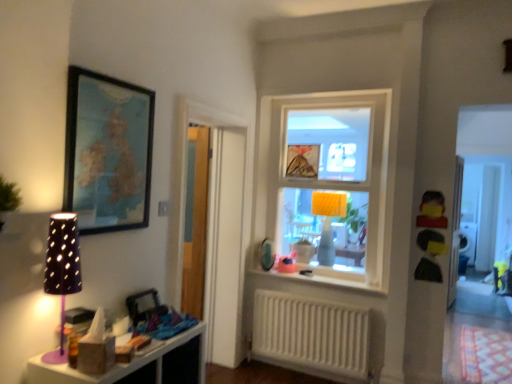
Question: Does matte plastic shelf at lower left have a smaller size compared to clear glass window at center?

Choices:
 (A) yes
 (B) no

Answer: (A)

Question: Is matte plastic shelf at lower left positioned behind clear glass window at center?

Choices:
 (A) no
 (B) yes

Answer: (A)

Question: From a real-world perspective, is matte plastic shelf at lower left under clear glass window at center?

Choices:
 (A) no
 (B) yes

Answer: (B)

Question: From a real-world perspective, is matte plastic shelf at lower left positioned over clear glass window at center based on gravity?

Choices:
 (A) no
 (B) yes

Answer: (A)

Question: Is matte plastic shelf at lower left facing away from clear glass window at center?

Choices:
 (A) yes
 (B) no

Answer: (B)

Question: Can clear glass window at center be found inside matte plastic shelf at lower left?

Choices:
 (A) no
 (B) yes

Answer: (A)

Question: Is yellow matte toy at right, which is the 2th toy in left-to-right order, in contact with purple matte table lamp at left, which is the 1th table lamp from front to back?

Choices:
 (A) no
 (B) yes

Answer: (A)

Question: From the image's perspective, is yellow matte toy at right, which is the 2th toy in left-to-right order, located beneath purple matte table lamp at left, which ranks as the second table lamp in back-to-front order?

Choices:
 (A) yes
 (B) no

Answer: (B)

Question: Considering the relative sizes of yellow matte toy at right, arranged as the 1th toy when viewed from the right, and purple matte table lamp at left, which is the 1th table lamp from front to back, in the image provided, is yellow matte toy at right, arranged as the 1th toy when viewed from the right, bigger than purple matte table lamp at left, which is the 1th table lamp from front to back,?

Choices:
 (A) no
 (B) yes

Answer: (A)

Question: Considering the relative sizes of yellow matte toy at right, the 1th toy when ordered from top to bottom, and purple matte table lamp at left, which is the 1th table lamp from front to back, in the image provided, is yellow matte toy at right, the 1th toy when ordered from top to bottom, thinner than purple matte table lamp at left, which is the 1th table lamp from front to back,?

Choices:
 (A) no
 (B) yes

Answer: (B)

Question: From a real-world perspective, is yellow matte toy at right, the 1th toy when ordered from top to bottom, physically above purple matte table lamp at left, which is the first table lamp from left to right?

Choices:
 (A) yes
 (B) no

Answer: (A)

Question: Is yellow matte toy at right, the 1th toy positioned from the front, taller than purple matte table lamp at left, which is the second table lamp in right-to-left order?

Choices:
 (A) yes
 (B) no

Answer: (B)

Question: Could you tell me if purple matte table lamp at left, which is the second table lamp in right-to-left order, is facing clear glass window at center?

Choices:
 (A) yes
 (B) no

Answer: (B)